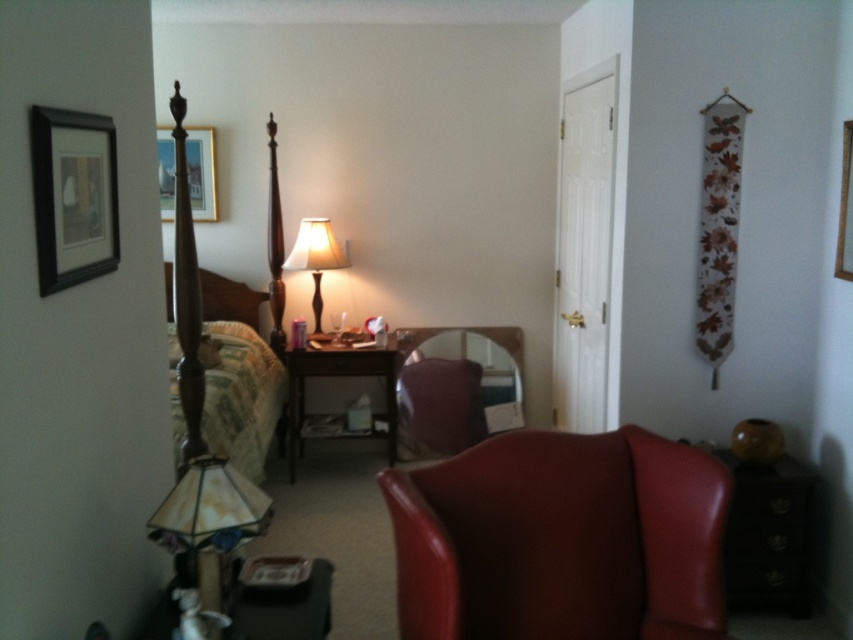
You are an interior designer assessing the lighting in the room. You need to place a decorative item that requires a wider base on one of the two lamps. Which lamp should you choose between the stained glass lampshade at lower left and the matte glass lamp at center?

The matte glass lamp at center has a wider base than the stained glass lampshade at lower left, so you should choose the matte glass lamp at center for placing the decorative item that requires a wider base.

From the picture: You are organizing a small party in the room and need to move a table between the brown wooden dresser at lower right and the green fabric pillow at left. Can you fit a table that is 1.2 meters wide in the space between them?

The brown wooden dresser at lower right is positioned on the right side of the green fabric pillow at left, so the distance between them is not specified. However, since the dresser is to the right of the pillow, there must be some space between them. Without exact measurements, it is uncertain if the 1.2 meter wide table would fit. Please check the actual distance between the brown wooden dresser at lower right and the green fabric pillow at left.